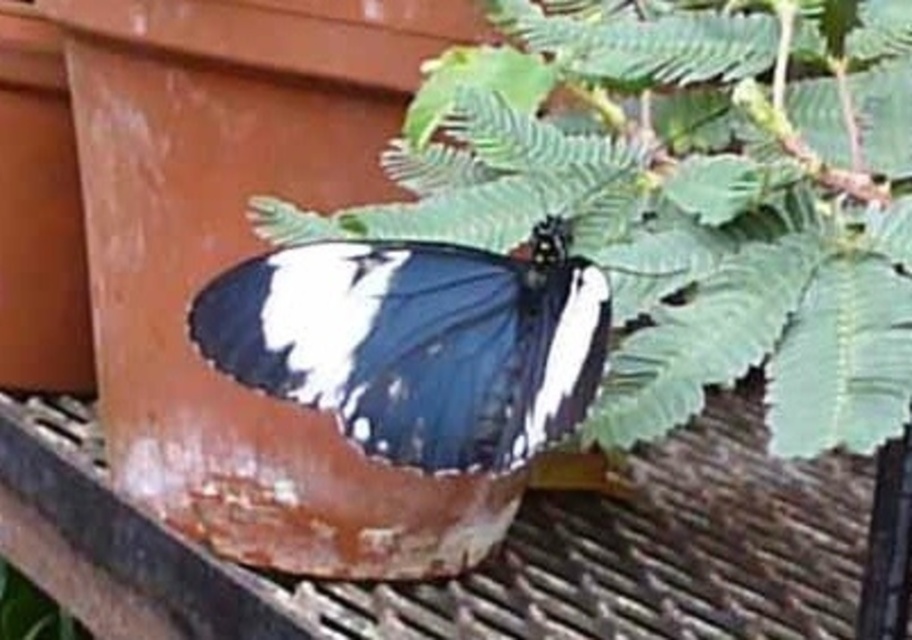
You are a photographer trying to capture a closeup of the shiny blue and white butterfly at center. The green leafy plant at upper center is blocking your view. Can you move the plant down to get a clear shot of the butterfly?

The green leafy plant at upper center is above the shiny blue and white butterfly at center, so moving the plant downward would allow you to get a clear shot of the butterfly.

You are a gardener checking the spacing between the green leafy plant at upper center and the shiny blue and white butterfly at center. Based on their positions, can you determine if the plant is wider than the butterfly?

A: The green leafy plant at upper center might be wider than shiny blue and white butterfly at center according to the description.